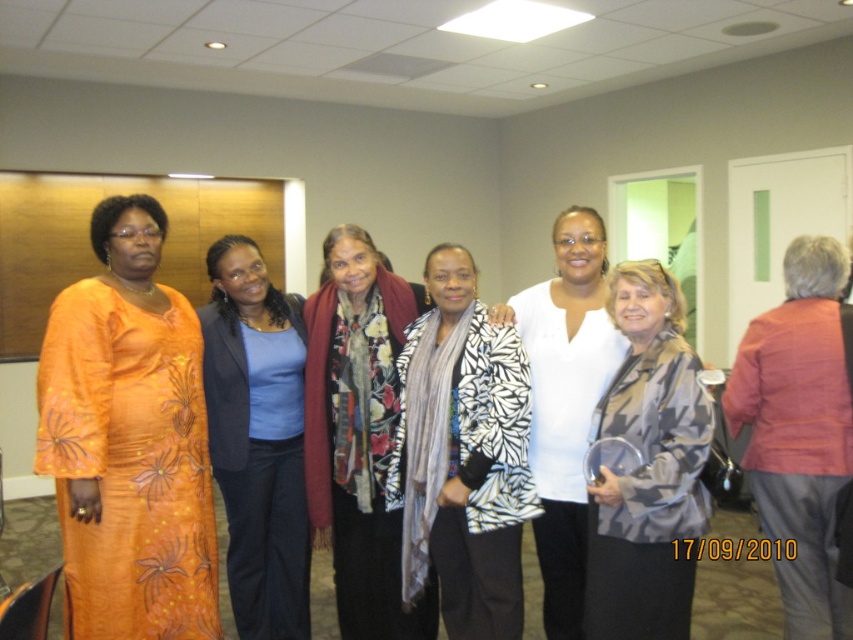
You are a photographer setting up for a group photo in the conference room. You notice the orange floral dress at left and the white matte shirt at center. Based on their positions, which one is closer to the ceiling lights?

The orange floral dress at left is above the white matte shirt at center, so it is closer to the ceiling lights.